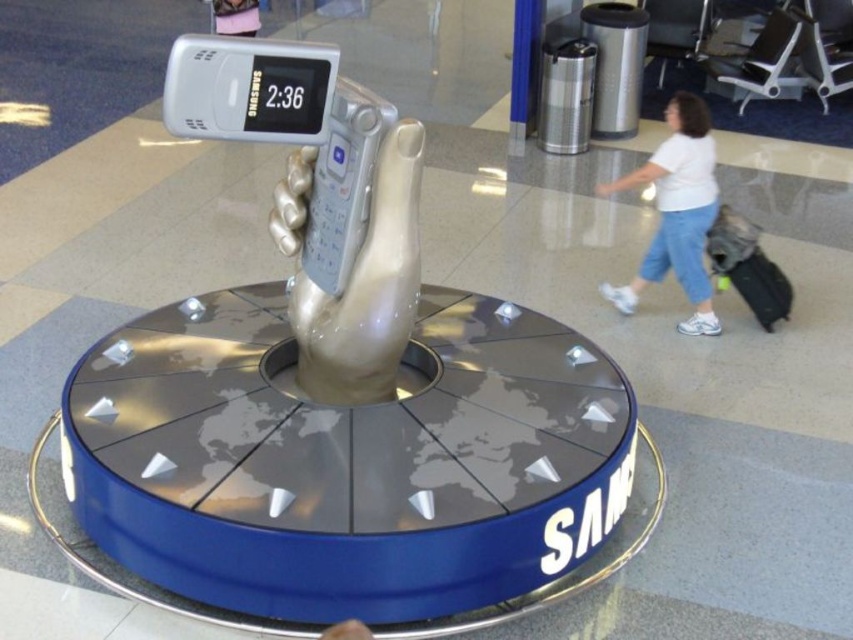
Question: Can you confirm if white cotton shirt at upper right is smaller than black fabric suitcase at right?

Choices:
 (A) no
 (B) yes

Answer: (A)

Question: Observing the image, what is the correct spatial positioning of white cotton shirt at upper right in reference to black fabric suitcase at right?

Choices:
 (A) left
 (B) right

Answer: (A)

Question: Among these objects, which one is nearest to the camera?

Choices:
 (A) white cotton shirt at upper right
 (B) black fabric suitcase at right

Answer: (A)

Question: Which point is closer to the camera taking this photo?

Choices:
 (A) (614, 180)
 (B) (735, 221)

Answer: (B)

Question: Is white cotton shirt at upper right positioned behind black fabric suitcase at right?

Choices:
 (A) no
 (B) yes

Answer: (A)

Question: Among these objects, which one is nearest to the camera?

Choices:
 (A) white cotton shirt at upper right
 (B) black fabric suitcase at right

Answer: (A)